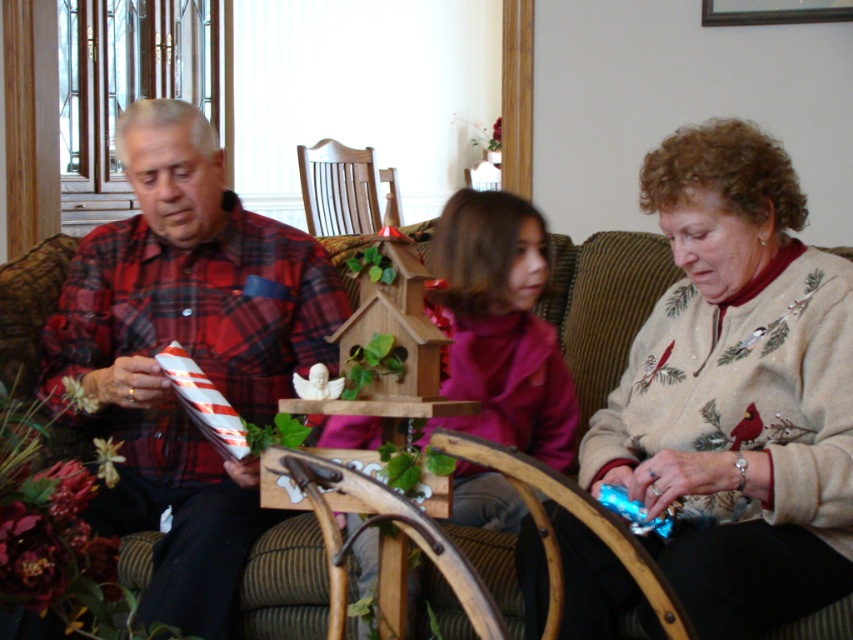
You are a delivery person who needs to place a small package between the beige embroidered sweater at right and the brown fabric couch at center. Can you fit it there?

The beige embroidered sweater at right and brown fabric couch at center are 25.56 inches apart, so yes, the small package can fit between them since the distance is sufficient.

You are sitting on the wooden rocking chair at center and want to hand a book to someone on the brown fabric couch at center. Which direction should you move to reach them?

Since the brown fabric couch at center is closer to the viewer than the wooden rocking chair at center, you should move forward towards the direction of the viewer to reach them.

You are standing in the living room and want to place a small plant on the sofa where the red plaid shirt at left is located. The coordinates for the best spot are given as point (187, 352). Where exactly on the red plaid shirt at left should you place the plant?

The point (187, 352) is located on the red plaid shirt at left, so you should place the plant directly on that area of the red plaid shirt at left.